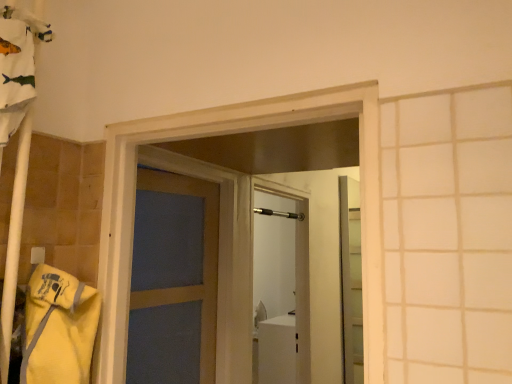
What do you see at coordinates (279, 213) in the screenshot?
I see `metallic silver shower at center` at bounding box center [279, 213].

Identify the location of metallic silver shower at center. (279, 213).

This screenshot has height=384, width=512. Describe the element at coordinates (350, 281) in the screenshot. I see `metallic elevator at right` at that location.

The width and height of the screenshot is (512, 384). I want to click on metallic elevator at right, so click(x=350, y=281).

Measure the distance between metallic elevator at right and camera.

metallic elevator at right is 3.07 meters from camera.

In order to face metallic elevator at right, should I rotate leftwards or rightwards?

Rotate right and turn 12.859 degrees.

What are the coordinates of `metallic silver shower at center` in the screenshot? It's located at (279, 213).

Between metallic elevator at right and metallic silver shower at center, which one appears on the right side from the viewer's perspective?

Positioned to the right is metallic elevator at right.

Is metallic elevator at right in front of metallic silver shower at center?

No, metallic elevator at right is behind metallic silver shower at center.

Considering the points (352, 306) and (302, 213), which point is behind, point (352, 306) or point (302, 213)?

The point (352, 306) is farther from the camera.

From the image's perspective, is metallic elevator at right below metallic silver shower at center?

Correct, metallic elevator at right appears lower than metallic silver shower at center in the image.

From a real-world perspective, relative to metallic silver shower at center, is metallic elevator at right vertically above or below?

metallic elevator at right is below metallic silver shower at center.

Considering the sizes of objects metallic elevator at right and metallic silver shower at center in the image provided, who is wider, metallic elevator at right or metallic silver shower at center?

metallic silver shower at center is wider.

Who is taller, metallic elevator at right or metallic silver shower at center?

metallic elevator at right is taller.

Between metallic elevator at right and metallic silver shower at center, which one has smaller size?

metallic silver shower at center.

Could metallic silver shower at center be considered to be inside metallic elevator at right?

No, metallic elevator at right does not contain metallic silver shower at center.

In the scene shown: Is metallic elevator at right far from metallic silver shower at center?

Actually, metallic elevator at right and metallic silver shower at center are a little close together.

Could you tell me if metallic elevator at right is turned towards metallic silver shower at center?

No, metallic elevator at right is not facing towards metallic silver shower at center.

Can you tell me how much metallic elevator at right and metallic silver shower at center differ in facing direction?

There is a 0.7-degree angle between the facing directions of metallic elevator at right and metallic silver shower at center.

Find the location of `elevator behind the metallic silver shower at center`. elevator behind the metallic silver shower at center is located at coordinates (350, 281).

Considering the positions of objects metallic silver shower at center and metallic elevator at right in the image provided, who is more to the right, metallic silver shower at center or metallic elevator at right?

metallic elevator at right.

Is the depth of metallic silver shower at center greater than that of metallic elevator at right?

No, it is in front of metallic elevator at right.

Which is in front, point (264, 211) or point (361, 365)?

The point (264, 211) is closer.

From the image's perspective, which is above, metallic silver shower at center or metallic elevator at right?

metallic silver shower at center appears higher in the image.

From a real-world perspective, is metallic silver shower at center physically located above or below metallic elevator at right?

From a real-world perspective, metallic silver shower at center is physically above metallic elevator at right.

Can you confirm if metallic silver shower at center is wider than metallic elevator at right?

Correct, the width of metallic silver shower at center exceeds that of metallic elevator at right.

From their relative heights in the image, would you say metallic silver shower at center is taller or shorter than metallic elevator at right?

In the image, metallic silver shower at center appears to be shorter than metallic elevator at right.

Does metallic silver shower at center have a larger size compared to metallic elevator at right?

No.

Is metallic silver shower at center situated inside metallic elevator at right or outside?

metallic silver shower at center is not inside metallic elevator at right, it's outside.

Is metallic silver shower at center not near metallic elevator at right?

metallic silver shower at center is actually quite close to metallic elevator at right.

Could you tell me if metallic silver shower at center is turned towards metallic elevator at right?

No, metallic silver shower at center is not turned towards metallic elevator at right.

Can you tell me how much metallic silver shower at center and metallic elevator at right differ in facing direction?

0.7 degrees.

I want to click on shower located above the metallic elevator at right (from a real-world perspective), so click(x=279, y=213).

Image resolution: width=512 pixels, height=384 pixels. I want to click on elevator directly beneath the metallic silver shower at center (from a real-world perspective), so click(350, 281).

This screenshot has width=512, height=384. Identify the location of shower located in front of the metallic elevator at right. (279, 213).